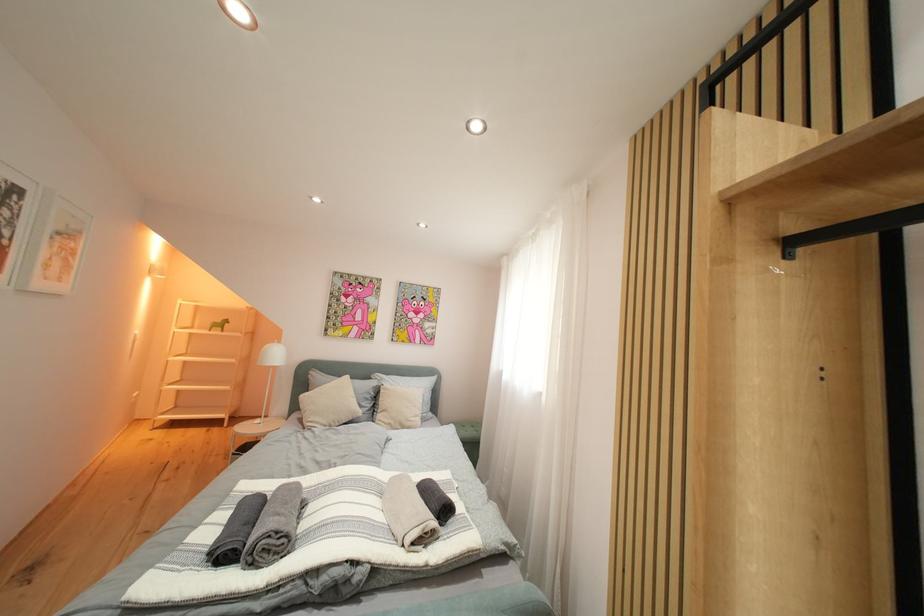
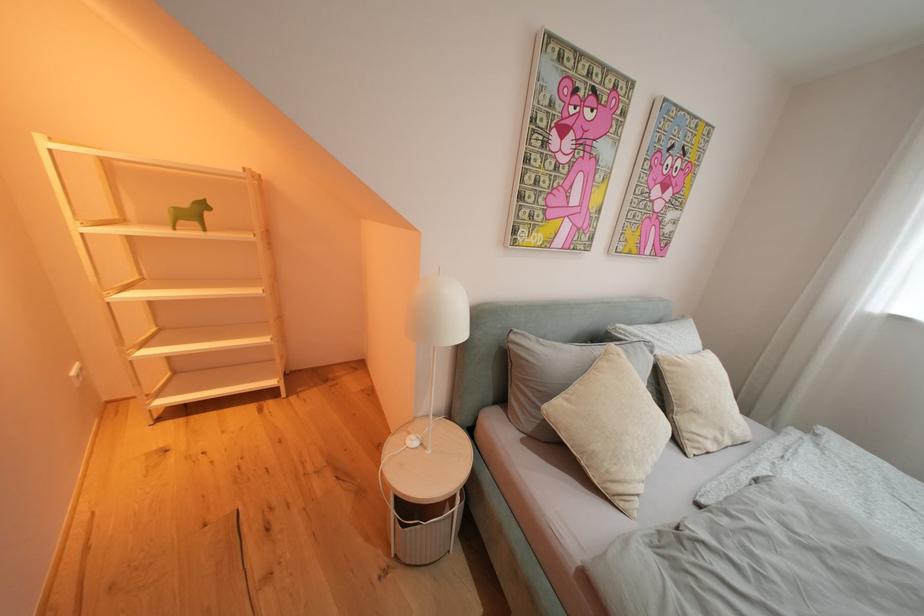
In a continuous first-person perspective shot, in which direction is the camera moving?

The cameraman walked toward left, forward.